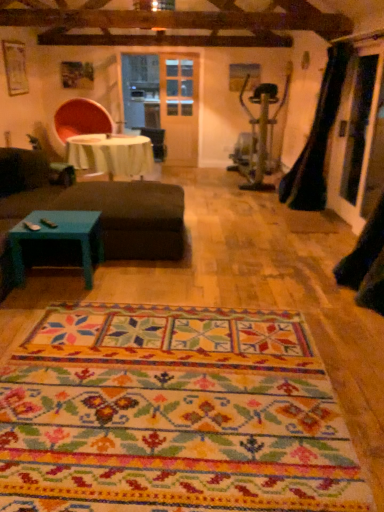
Question: Considering the relative positions of teal painted wood coffee table at lower left and white fabric table at center in the image provided, is teal painted wood coffee table at lower left to the right of white fabric table at center from the viewer's perspective?

Choices:
 (A) no
 (B) yes

Answer: (B)

Question: Is teal painted wood coffee table at lower left positioned before white fabric table at center?

Choices:
 (A) yes
 (B) no

Answer: (A)

Question: Is teal painted wood coffee table at lower left shorter than white fabric table at center?

Choices:
 (A) no
 (B) yes

Answer: (B)

Question: Is teal painted wood coffee table at lower left in contact with white fabric table at center?

Choices:
 (A) yes
 (B) no

Answer: (B)

Question: From the image's perspective, is teal painted wood coffee table at lower left over white fabric table at center?

Choices:
 (A) yes
 (B) no

Answer: (B)

Question: From a real-world perspective, is teal painted wood coffee table at lower left physically below white fabric table at center?

Choices:
 (A) yes
 (B) no

Answer: (A)

Question: From a real-world perspective, is black leather guitar case at right located beneath multicolored woven mat at center?

Choices:
 (A) yes
 (B) no

Answer: (B)

Question: From the image's perspective, is black leather guitar case at right beneath multicolored woven mat at center?

Choices:
 (A) yes
 (B) no

Answer: (B)

Question: Is black leather guitar case at right closer to the viewer compared to multicolored woven mat at center?

Choices:
 (A) yes
 (B) no

Answer: (B)

Question: Does black leather guitar case at right have a greater width compared to multicolored woven mat at center?

Choices:
 (A) yes
 (B) no

Answer: (B)

Question: Does black leather guitar case at right have a larger size compared to multicolored woven mat at center?

Choices:
 (A) no
 (B) yes

Answer: (B)

Question: Is black leather guitar case at right with multicolored woven mat at center?

Choices:
 (A) no
 (B) yes

Answer: (A)

Question: Is white fabric table at center to the left of black leather guitar case at right from the viewer's perspective?

Choices:
 (A) yes
 (B) no

Answer: (A)